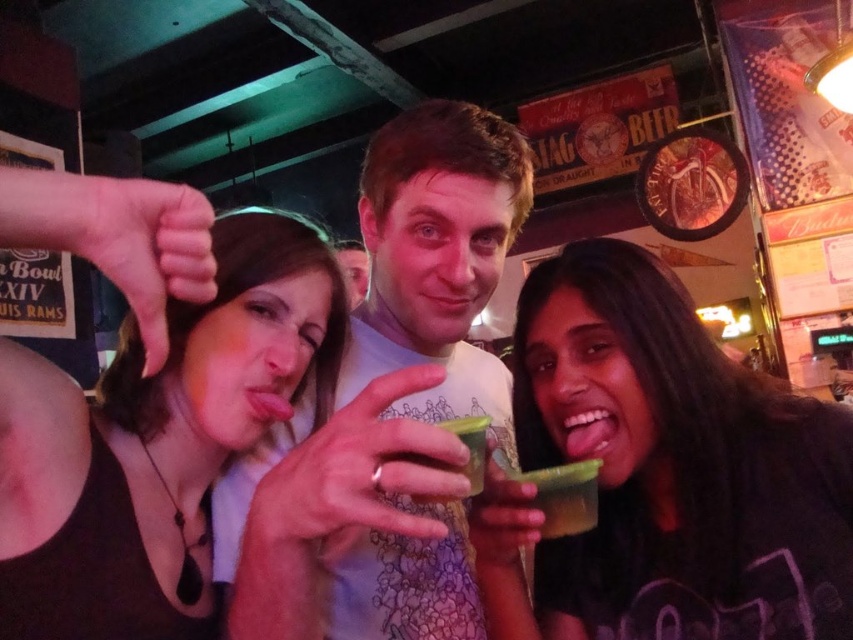
Does matte black tank top at upper left appear on the left side of matte white t-shirt at center?

Yes, matte black tank top at upper left is to the left of matte white t-shirt at center.

Measure the distance between matte black tank top at upper left and matte white t-shirt at center.

matte black tank top at upper left and matte white t-shirt at center are 5.31 inches apart from each other.

Find the location of a particular element. matte black tank top at upper left is located at coordinates (158, 442).

Is matte white t-shirt at center thinner than green translucent cup at center?

Incorrect, matte white t-shirt at center's width is not less than green translucent cup at center's.

Can you confirm if matte white t-shirt at center is smaller than green translucent cup at center?

Actually, matte white t-shirt at center might be larger than green translucent cup at center.

Who is more distant from viewer, (456, 296) or (424, 500)?

Point (456, 296)

I want to click on matte white t-shirt at center, so click(x=437, y=257).

Which is above, matte white t-shirt at center or green translucent glass at lower center?

matte white t-shirt at center is higher up.

Between matte white t-shirt at center and green translucent glass at lower center, which one has less height?

green translucent glass at lower center

Who is more distant from viewer, (450,516) or (593,518)?

Positioned behind is point (450,516).

Locate an element on the screen. This screenshot has width=853, height=640. matte white t-shirt at center is located at coordinates (437, 257).